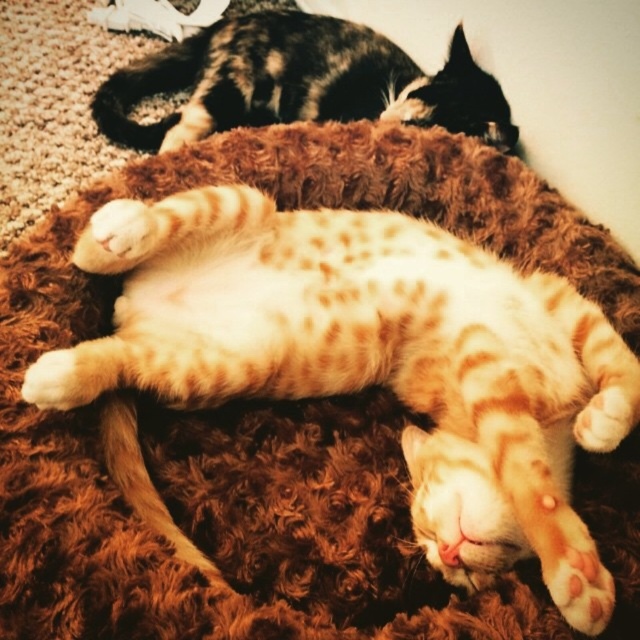
You are a photographer standing at a distance of 1 meter from the orange spotted fur cat at center. You want to take a closeup photo of it without disturbing the cat. Since the cat is sensitive to sudden movements, you can only move closer by 30 centimeters. Will you be able to get close enough to take the closeup?

The orange spotted fur cat at center is 70.74 centimeters away from viewer. If you move closer by 30 centimeters, your new distance will be 70.74 cm minus 30 cm equals 40.74 centimeters. Since 40.74 centimeters is still more than the required distance for a closeup, you might need to get even closer, but moving further could disturb the cat. However, based on the given information, moving 30 cm closer would not be sufficient for a typical closeup which usually requires a distance closer than 40 cm.

You are a photographer trying to capture both cats in a single frame. Given that the orange spotted fur cat at center is smaller in width than the tabby fur cat at upper center, which cat should you focus on to ensure both fit in the frame without cropping?

Since the orange spotted fur cat at center is narrower than the tabby fur cat at upper center, you should focus on positioning the camera so that the smaller orange spotted fur cat at center is centered, allowing the wider tabby fur cat at upper center to fit within the frame as well.